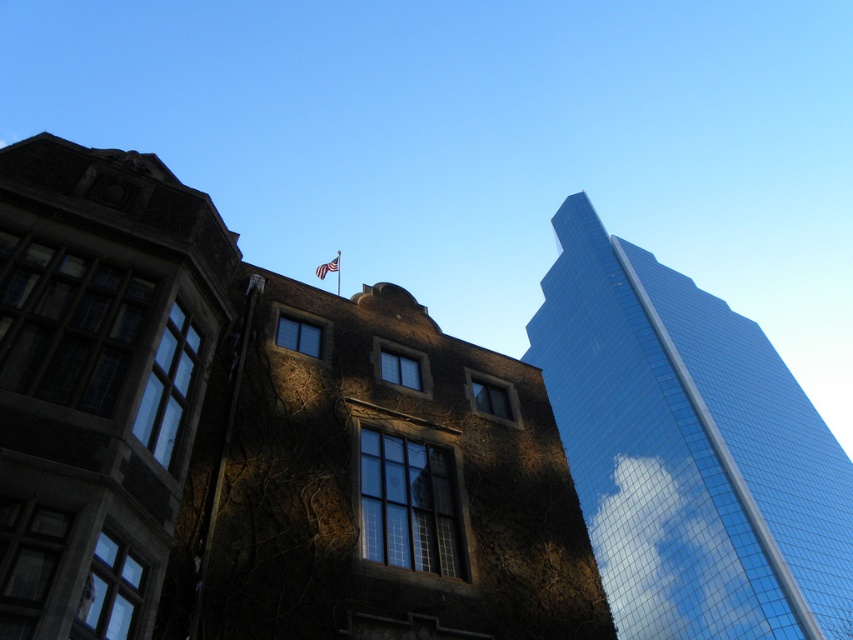
Question: Can you confirm if shiny glass skyscraper at right is thinner than american flag at upper center?

Choices:
 (A) yes
 (B) no

Answer: (B)

Question: Which point appears farthest from the camera in this image?

Choices:
 (A) (781, 547)
 (B) (317, 266)

Answer: (A)

Question: From the image, what is the correct spatial relationship of shiny glass skyscraper at right in relation to american flag at upper center?

Choices:
 (A) left
 (B) right

Answer: (B)

Question: Which point is farther to the camera?

Choices:
 (A) american flag at upper center
 (B) shiny glass skyscraper at right

Answer: (B)

Question: Where is shiny glass skyscraper at right located in relation to american flag at upper center in the image?

Choices:
 (A) below
 (B) above

Answer: (A)